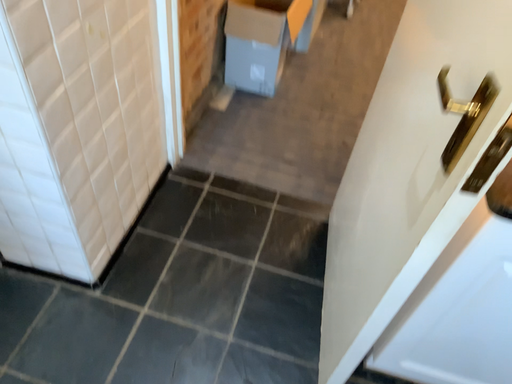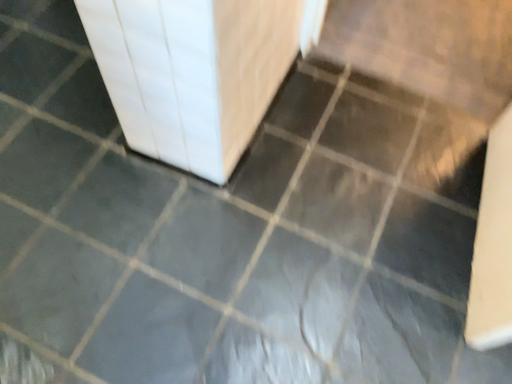
Question: How did the camera likely rotate when shooting the video?

Choices:
 (A) rotated left
 (B) rotated right

Answer: (A)